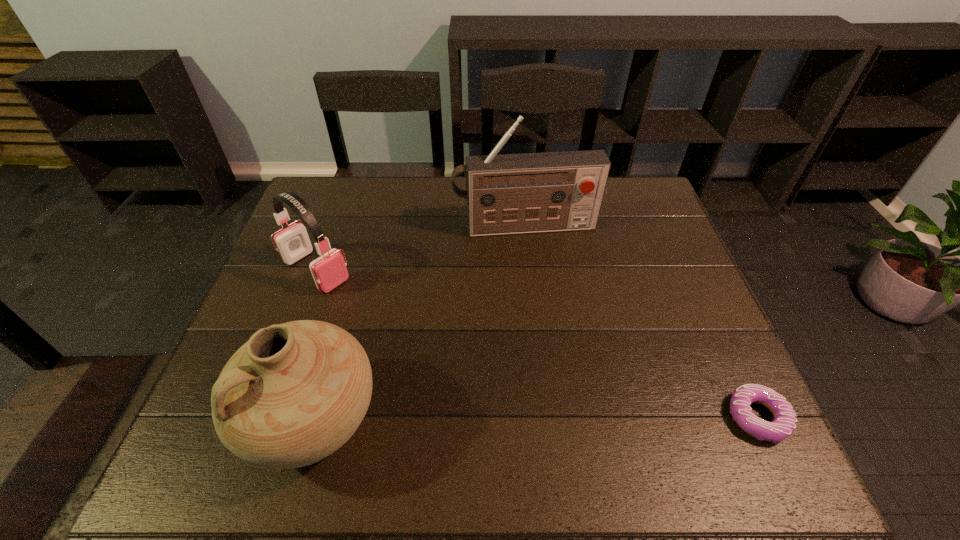
Find the location of `free space between the second object from right to left and the pottery`. free space between the second object from right to left and the pottery is located at coordinates (419, 323).

The height and width of the screenshot is (540, 960). What are the coordinates of `empty space that is in between the tallest object and the pottery` in the screenshot? It's located at (419, 323).

Image resolution: width=960 pixels, height=540 pixels. What are the coordinates of `empty location between the farthest object and the pottery` in the screenshot? It's located at (x=419, y=323).

This screenshot has width=960, height=540. What are the coordinates of `empty space between the second farthest object and the shortest object` in the screenshot? It's located at [537, 344].

Locate an element on the screen. This screenshot has height=540, width=960. free space between the farthest object and the rightmost object is located at coordinates (641, 322).

You are a GUI agent. You are given a task and a screenshot of the screen. Output one action in this format:
    pyautogui.click(x=<x>, y=<y>)
    Task: Click on the vacant region between the pottery and the third object from left to right
    This screenshot has width=960, height=540.
    Given the screenshot: What is the action you would take?
    click(419, 323)

Where is `the closest object to the radio receiver`? the closest object to the radio receiver is located at coordinates (329, 270).

Point out which object is positioned as the second nearest to the earphone. Please provide its 2D coordinates. Your answer should be formatted as a tuple, i.e. [(x, y)], where the tuple contains the x and y coordinates of a point satisfying the conditions above.

[(506, 194)]

I want to click on free spot that satisfies the following two spatial constraints: 1. on the back side of the pottery; 2. on the right side of the shortest object, so click(x=314, y=417).